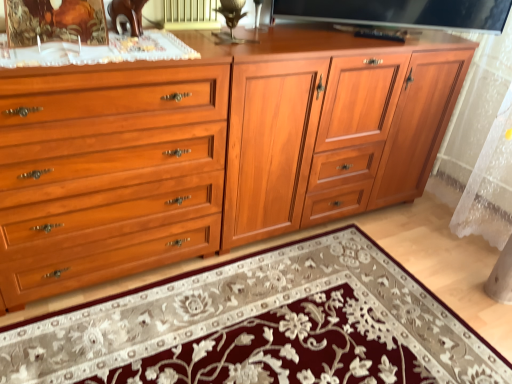
Question: Is matte wood chest of drawers at left facing away from matte wood cabinet at center?

Choices:
 (A) no
 (B) yes

Answer: (A)

Question: Is matte wood chest of drawers at left facing towards matte wood cabinet at center?

Choices:
 (A) yes
 (B) no

Answer: (B)

Question: Is matte wood chest of drawers at left beside matte wood cabinet at center?

Choices:
 (A) yes
 (B) no

Answer: (B)

Question: Considering the relative sizes of matte wood chest of drawers at left and matte wood cabinet at center in the image provided, is matte wood chest of drawers at left shorter than matte wood cabinet at center?

Choices:
 (A) no
 (B) yes

Answer: (B)

Question: Is matte wood chest of drawers at left behind matte wood cabinet at center?

Choices:
 (A) yes
 (B) no

Answer: (B)

Question: Would you say matte wood chest of drawers at left contains matte wood cabinet at center?

Choices:
 (A) no
 (B) yes

Answer: (A)

Question: Is wooden picture frame at upper left to the left of matte wood cabinet at center from the viewer's perspective?

Choices:
 (A) no
 (B) yes

Answer: (B)

Question: Is wooden picture frame at upper left bigger than matte wood cabinet at center?

Choices:
 (A) yes
 (B) no

Answer: (B)

Question: From a real-world perspective, is wooden picture frame at upper left located higher than matte wood cabinet at center?

Choices:
 (A) yes
 (B) no

Answer: (A)

Question: From a real-world perspective, is wooden picture frame at upper left physically below matte wood cabinet at center?

Choices:
 (A) no
 (B) yes

Answer: (A)

Question: Is there a large distance between wooden picture frame at upper left and matte wood cabinet at center?

Choices:
 (A) no
 (B) yes

Answer: (B)

Question: Does wooden picture frame at upper left come behind matte wood cabinet at center?

Choices:
 (A) no
 (B) yes

Answer: (A)

Question: From the image's perspective, does matte wood cabinet at center appear higher than embroidered wool mat at center?

Choices:
 (A) no
 (B) yes

Answer: (B)